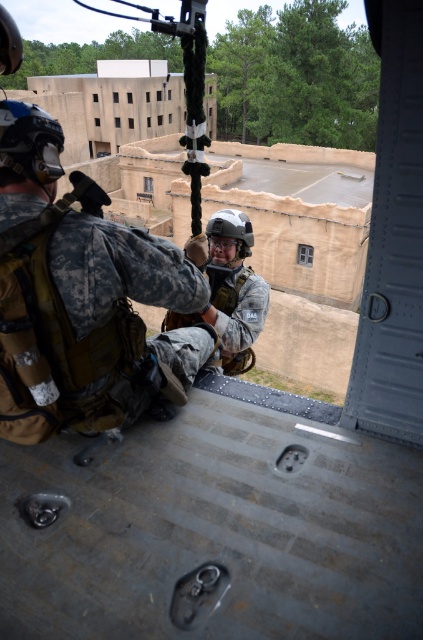
Question: Is camouflage fabric uniform at left smaller than camouflage fabric helmet at center?

Choices:
 (A) yes
 (B) no

Answer: (A)

Question: Which point is closer to the camera?

Choices:
 (A) (249, 246)
 (B) (35, 339)

Answer: (B)

Question: Does camouflage fabric uniform at left appear on the right side of camouflage fabric helmet at center?

Choices:
 (A) yes
 (B) no

Answer: (B)

Question: Does camouflage fabric uniform at left appear over camouflage fabric helmet at center?

Choices:
 (A) no
 (B) yes

Answer: (B)